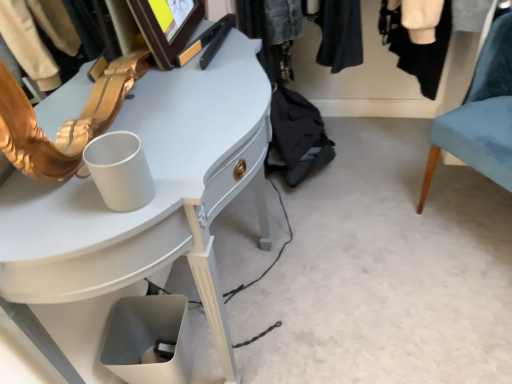
Find the location of a particular element. This screenshot has width=512, height=384. empty space that is in between velvet teal chair at right and white glossy desk at upper left is located at coordinates (375, 259).